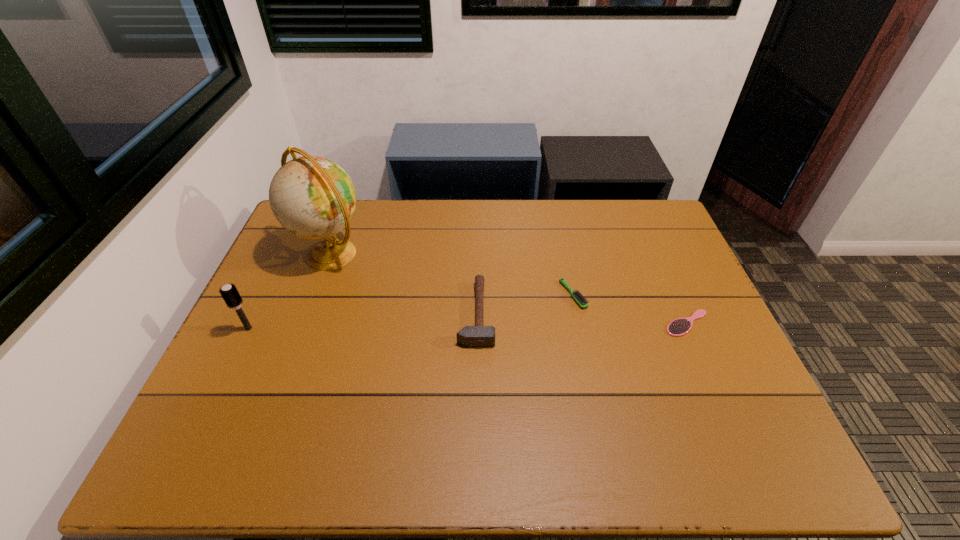
Find the location of a particular element. Image resolution: width=960 pixels, height=540 pixels. free space located on the front of the tallest object is located at coordinates tap(278, 396).

The width and height of the screenshot is (960, 540). I want to click on free location located on the front of the leftmost hairbrush, so click(181, 469).

Where is `free space located 0.360m on the striking surface of the hammer`? The width and height of the screenshot is (960, 540). free space located 0.360m on the striking surface of the hammer is located at coordinates (622, 314).

What are the coordinates of `free region located on the right of the second shortest object` in the screenshot? It's located at (654, 295).

Locate an element on the screen. The image size is (960, 540). vacant space located on the left of the shortest hairbrush is located at coordinates (580, 323).

Identify the location of object positioned at the far edge. (312, 197).

The width and height of the screenshot is (960, 540). Identify the location of globe that is positioned at the left edge. (312, 197).

Find the location of a particular element. Image resolution: width=960 pixels, height=540 pixels. hairbrush that is at the left edge is located at coordinates (229, 292).

Locate an element on the screen. This screenshot has height=540, width=960. object present at the right edge is located at coordinates (681, 326).

Where is `object situated at the far left corner`? This screenshot has width=960, height=540. object situated at the far left corner is located at coordinates (312, 197).